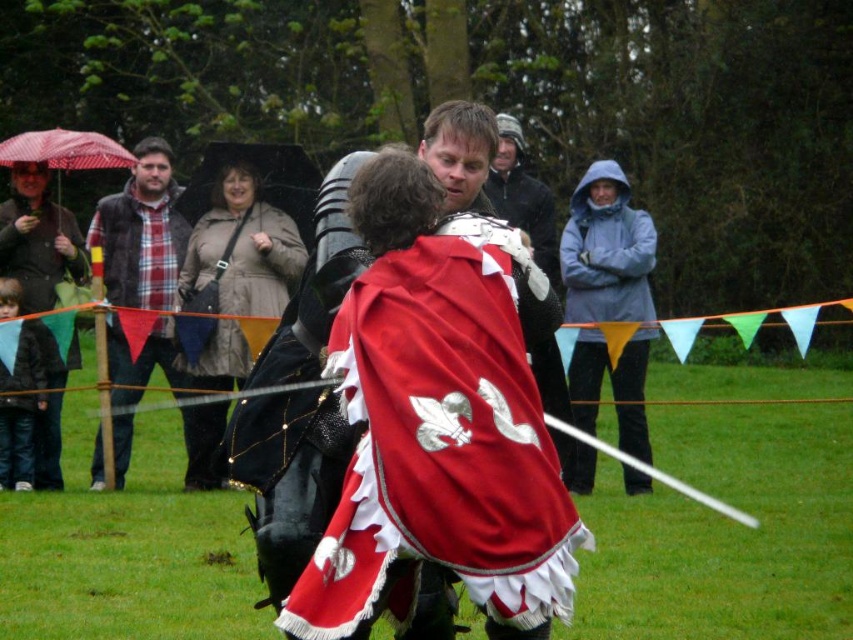
You are a photographer at the medieval event. You want to take a photo focusing on both the point at coordinates point (x=503, y=481) and point (x=142, y=170). Since you need to ensure both points are in focus, which point should you adjust the camera focus to prioritize?

You should prioritize focusing on point (x=503, y=481) because it is closer to the camera. In photography, focusing on the closer subject increases the likelihood that both points will be in focus due to the depth of field extending beyond the focal point.

You are standing at the origin point of the coordinate system in the image. The velvet red cape at center is located at point (442, 440). If you want to move towards the velvet red cape at center, which direction should you go?

The velvet red cape at center is located at coordinate point (442, 440), so you should move towards that coordinate point to reach it.